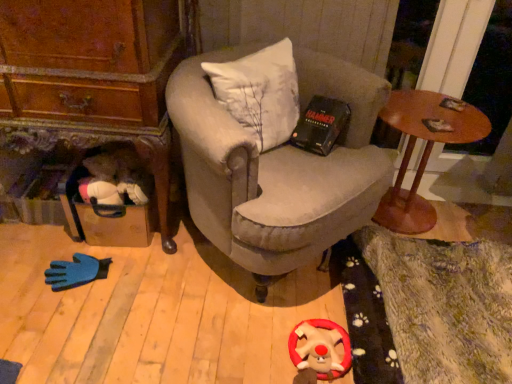
Where is `vacant space behind velvety red plush reindeer at lower center`? vacant space behind velvety red plush reindeer at lower center is located at coordinates (302, 310).